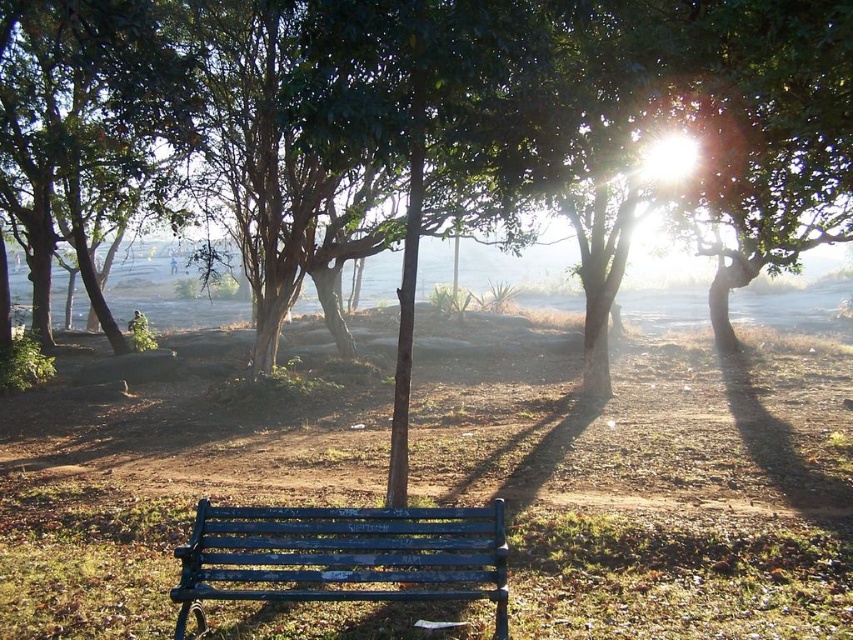
Question: Which of the following is the farthest from the observer?

Choices:
 (A) green grass at center
 (B) blue painted wood bench at center
 (C) green leafy tree at center

Answer: (C)

Question: Does green leafy tree at center lie behind blue painted wood bench at center?

Choices:
 (A) yes
 (B) no

Answer: (A)

Question: Is green grass at center further to the viewer compared to green leafy tree at center?

Choices:
 (A) yes
 (B) no

Answer: (B)

Question: Which is farther from the green leafy tree at center?

Choices:
 (A) green grass at center
 (B) blue painted wood bench at center

Answer: (B)

Question: Does green grass at center appear on the right side of blue painted wood bench at center?

Choices:
 (A) no
 (B) yes

Answer: (B)

Question: Which of the following is the farthest from the observer?

Choices:
 (A) (321, 600)
 (B) (402, 61)

Answer: (B)